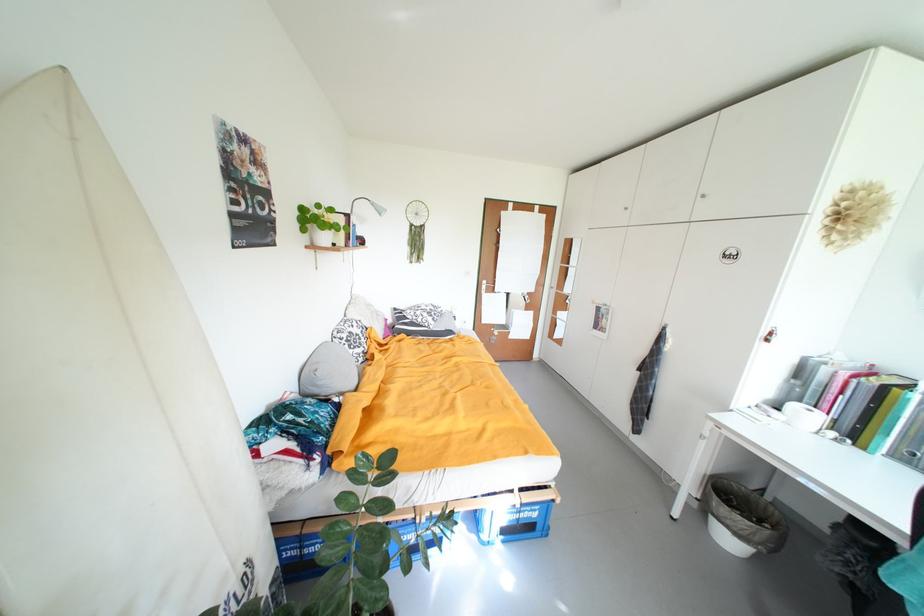
You are a GUI agent. You are given a task and a screenshot of the screen. Output one action in this format:
    pyautogui.click(x=<x>, y=<y>)
    Task: Click on the brown door handle
    The width and height of the screenshot is (924, 616).
    Given the screenshot: What is the action you would take?
    pyautogui.click(x=485, y=288)